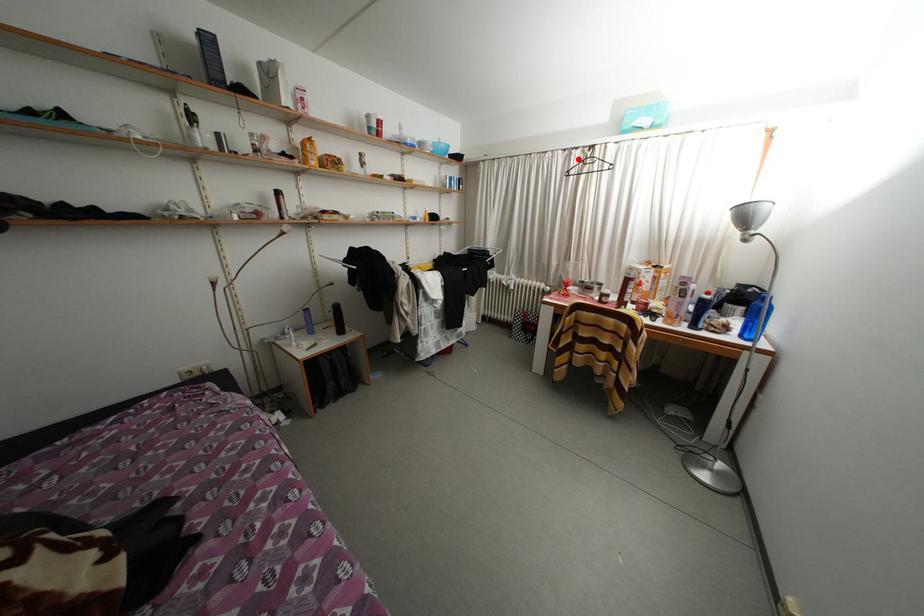
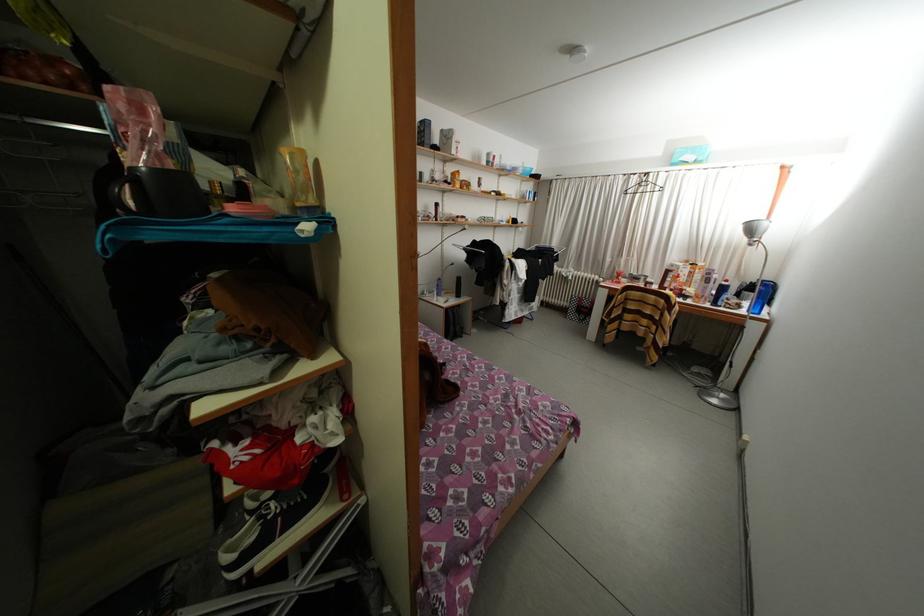
The point at the highlighted location is marked in the first image. Where is the corresponding point in the second image?

(638, 184)